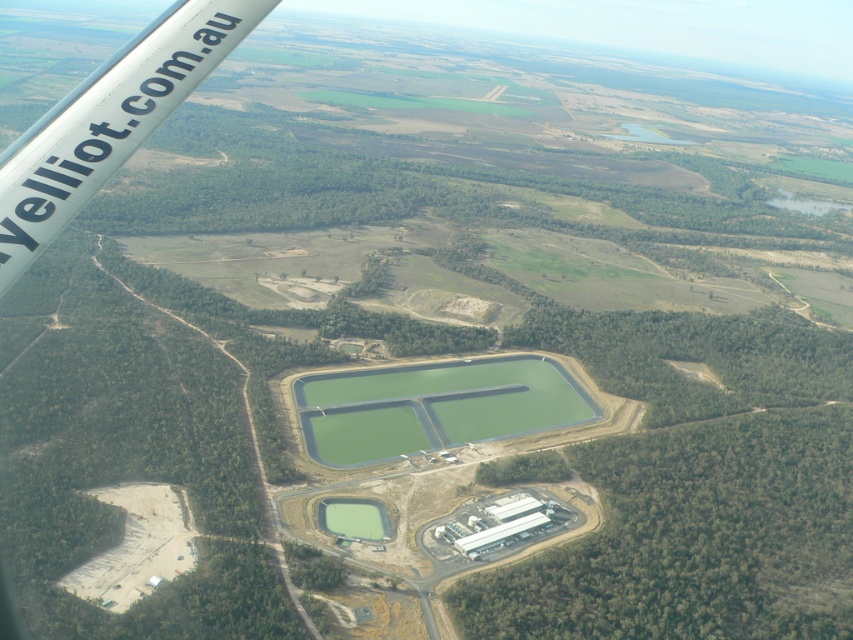
You are a pilot reviewing the aerial image of the rural landscape. You need to determine if the white glossy wing at upper left can fit entirely within the green liquid at center area without overlapping its edges. Based on their sizes, what would you conclude?

The white glossy wing at upper left has a smaller width than the green liquid at center, so it can fit entirely within the green liquid at center area without overlapping its edges.

You are viewing an aerial image of a rural area from an airplane window. You see a green concrete water at center. Can you determine its exact 2D coordinates based on the image?

The green concrete water at center is located at coordinates point (432,406).

You are a pilot reviewing an aerial image for environmental analysis. The image shows a rural area with a large green concrete water at center and a smaller green liquid at center. Which of the two has a greater area coverage according to the image?

The green concrete water at center has a larger size compared to the green liquid at center, so it has a greater area coverage.